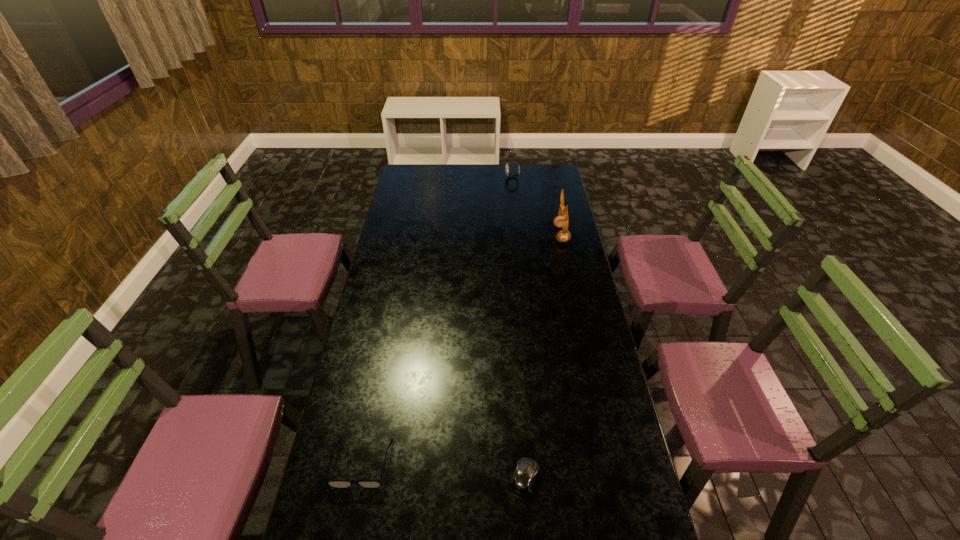
The height and width of the screenshot is (540, 960). Identify the location of vacant space situated on the face of the farthest object. (463, 177).

Where is `vacant space situated on the face of the farthest object`? This screenshot has height=540, width=960. vacant space situated on the face of the farthest object is located at coordinates (486, 177).

Locate an element on the screen. vacant region located on the front-facing side of the spectacles is located at coordinates tap(352, 512).

Identify the location of vacant space located 0.110m on the left of the mouse. (472, 477).

You are a GUI agent. You are given a task and a screenshot of the screen. Output one action in this format:
    pyautogui.click(x=<x>, y=<y>)
    Task: Click on the object positioned at the far edge
    
    Given the screenshot: What is the action you would take?
    pyautogui.click(x=512, y=162)

This screenshot has height=540, width=960. In order to click on object that is at the left edge in this screenshot , I will do `click(338, 484)`.

In order to click on object present at the right edge in this screenshot , I will do `click(560, 221)`.

This screenshot has width=960, height=540. Identify the location of free space at the far edge of the desktop. coord(445,173).

Locate an element on the screen. This screenshot has width=960, height=540. free space at the left edge is located at coordinates (357, 474).

In order to click on vacant space at the right edge in this screenshot , I will do `click(622, 428)`.